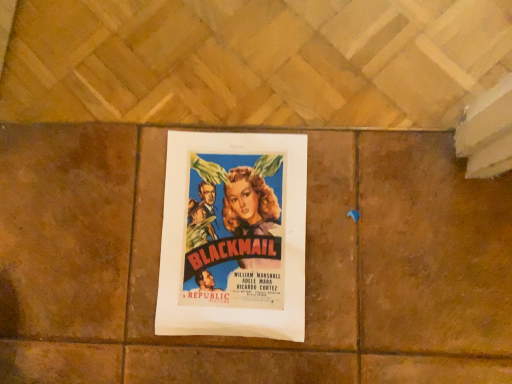
Locate an element on the screen. Image resolution: width=512 pixels, height=384 pixels. empty space that is ontop of matte paper poster at center (from a real-world perspective) is located at coordinates (231, 226).